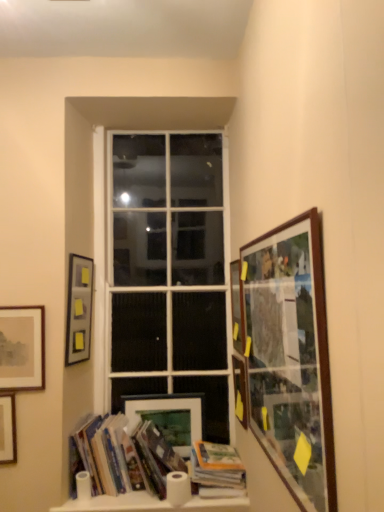
Locate an element on the screen. The image size is (384, 512). vacant point above white glass window at center (from a real-world perspective) is located at coordinates (169, 124).